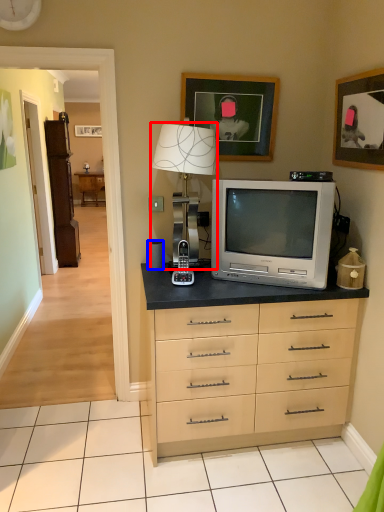
Question: Which of the following is the closest to the observer, table lamp (highlighted by a red box) or speaker (highlighted by a blue box)?

Choices:
 (A) table lamp
 (B) speaker

Answer: (A)